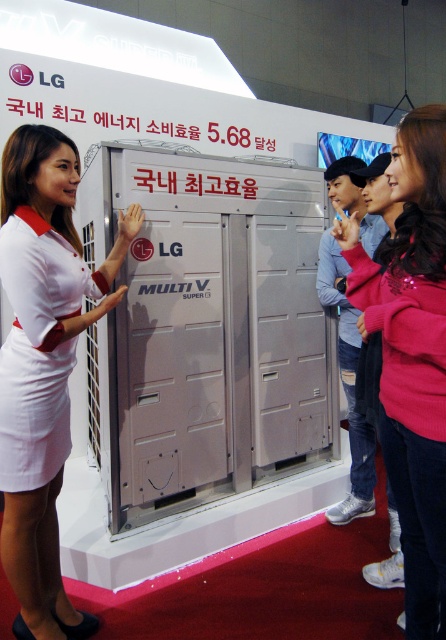
Does silver metallic locker at center appear over white cotton dress at left?

Yes.

Can you confirm if silver metallic locker at center is smaller than white cotton dress at left?

Incorrect, silver metallic locker at center is not smaller in size than white cotton dress at left.

Is point (172, 365) closer to camera compared to point (1, 266)?

No, (172, 365) is further to viewer.

I want to click on silver metallic locker at center, so click(x=206, y=330).

Is silver metallic locker at center bigger than white fabric dress at left?

Correct, silver metallic locker at center is larger in size than white fabric dress at left.

Which is behind, point (247, 440) or point (36, 288)?

The point (247, 440) is behind.

Where is `silver metallic locker at center`? silver metallic locker at center is located at coordinates (206, 330).

Consider the image. Who is lower down, silver metallic locker at center or pink sequined sweater at center?

pink sequined sweater at center is below.

Does silver metallic locker at center have a greater height compared to pink sequined sweater at center?

Indeed, silver metallic locker at center has a greater height compared to pink sequined sweater at center.

Between point (168, 340) and point (412, 157), which one is positioned in front?

Point (412, 157) is more forward.

At what (x,y) coordinates should I click in order to perform the action: click on silver metallic locker at center. Please return your answer as a coordinate pair (x, y). Image resolution: width=446 pixels, height=640 pixels. Looking at the image, I should click on click(206, 330).